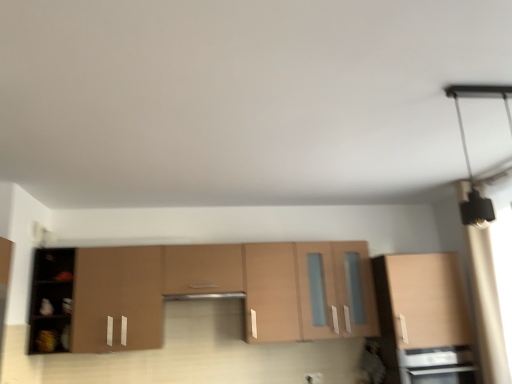
You are a GUI agent. You are given a task and a screenshot of the screen. Output one action in this format:
    pyautogui.click(x=<x>, y=<y>)
    Task: Click on the matte wood cabinet at right, the second cabinetry in the left-to-right sequence
    
    Given the screenshot: What is the action you would take?
    pos(423,319)

Describe the element at coordinates (437, 365) in the screenshot. I see `matte black oven at lower right` at that location.

This screenshot has height=384, width=512. What do you see at coordinates (203, 291) in the screenshot?
I see `matte brown cabinet at center, placed as the first cabinetry when sorted from left to right` at bounding box center [203, 291].

You are a GUI agent. You are given a task and a screenshot of the screen. Output one action in this format:
    pyautogui.click(x=<x>, y=<y>)
    Task: Click on the matte wood cabinet at right, the second cabinetry in the left-to-right sequence
    Image resolution: width=512 pixels, height=384 pixels.
    Given the screenshot: What is the action you would take?
    pyautogui.click(x=423, y=319)

Which object is thinner, matte black oven at lower right or satin silver exhaust hood at center?

satin silver exhaust hood at center is thinner.

Considering the relative positions of matte black oven at lower right and satin silver exhaust hood at center in the image provided, is matte black oven at lower right to the right of satin silver exhaust hood at center from the viewer's perspective?

Indeed, matte black oven at lower right is positioned on the right side of satin silver exhaust hood at center.

Does point (438, 380) lie behind point (242, 297)?

No.

Is the position of matte black oven at lower right more distant than that of satin silver exhaust hood at center?

No, it is not.

Is matte wood cabinet at right, acting as the 1th cabinetry starting from the right, bigger or smaller than satin silver exhaust hood at center?

In the image, matte wood cabinet at right, acting as the 1th cabinetry starting from the right, appears to be larger than satin silver exhaust hood at center.

Which object is positioned more to the left, matte wood cabinet at right, the second cabinetry in the left-to-right sequence, or satin silver exhaust hood at center?

From the viewer's perspective, satin silver exhaust hood at center appears more on the left side.

Is matte wood cabinet at right, the second cabinetry in the left-to-right sequence, aimed at satin silver exhaust hood at center?

No.

Locate an element on the screen. This screenshot has width=512, height=384. the 1st cabinetry in front of the satin silver exhaust hood at center is located at coordinates (423, 319).

Does satin silver exhaust hood at center contain black matte light fixture at upper right?

Definitely not — black matte light fixture at upper right is not inside satin silver exhaust hood at center.

Does point (240, 297) appear closer or farther from the camera than point (477, 192)?

Point (240, 297) is farther from the camera than point (477, 192).

Which is in front, satin silver exhaust hood at center or black matte light fixture at upper right?

black matte light fixture at upper right is more forward.

Who is bigger, satin silver exhaust hood at center or black matte light fixture at upper right?

With larger size is black matte light fixture at upper right.

Can you tell me how much matte black oven at lower right and matte brown cabinet at center, placed as the first cabinetry when sorted from left to right, differ in facing direction?

1.6e-05 degrees.

Is matte black oven at lower right not close to matte brown cabinet at center, placed as the first cabinetry when sorted from left to right?

They are positioned close to each other.

Is matte black oven at lower right wider or thinner than matte brown cabinet at center, which is the 2th cabinetry from right to left?

matte black oven at lower right is wider than matte brown cabinet at center, which is the 2th cabinetry from right to left.

Consider the image. Is black matte light fixture at upper right positioned before matte wood cabinet at right, acting as the 1th cabinetry starting from the right?

Yes, the depth of black matte light fixture at upper right is less than that of matte wood cabinet at right, acting as the 1th cabinetry starting from the right.

From a real-world perspective, is black matte light fixture at upper right located higher than matte wood cabinet at right, acting as the 1th cabinetry starting from the right?

Yes, from a real-world perspective, black matte light fixture at upper right is over matte wood cabinet at right, acting as the 1th cabinetry starting from the right

Considering the relative sizes of black matte light fixture at upper right and matte wood cabinet at right, acting as the 1th cabinetry starting from the right, in the image provided, is black matte light fixture at upper right taller than matte wood cabinet at right, acting as the 1th cabinetry starting from the right,?

Answer: No, black matte light fixture at upper right is not taller than matte wood cabinet at right, acting as the 1th cabinetry starting from the right.

Which is more to the left, black matte light fixture at upper right or matte wood cabinet at right, the second cabinetry in the left-to-right sequence?

From the viewer's perspective, black matte light fixture at upper right appears more on the left side.

At what (x,y) coordinates should I click in order to perform the action: click on light fixture above the matte brown cabinet at center, which is the 2th cabinetry from right to left (from a real-world perspective). Please return your answer as a coordinate pair (x, y). This screenshot has width=512, height=384. Looking at the image, I should click on (467, 151).

Is matte brown cabinet at center, placed as the first cabinetry when sorted from left to right, positioned beyond the bounds of black matte light fixture at upper right?

That's correct, matte brown cabinet at center, placed as the first cabinetry when sorted from left to right, is outside of black matte light fixture at upper right.

Does point (322, 293) lie in front of point (474, 219)?

No, (322, 293) is further to viewer.

Can you confirm if matte brown cabinet at center, placed as the first cabinetry when sorted from left to right, is positioned to the left of black matte light fixture at upper right?

Yes, matte brown cabinet at center, placed as the first cabinetry when sorted from left to right, is to the left of black matte light fixture at upper right.

Is satin silver exhaust hood at center at the left side of matte brown cabinet at center, placed as the first cabinetry when sorted from left to right?

Indeed, satin silver exhaust hood at center is positioned on the left side of matte brown cabinet at center, placed as the first cabinetry when sorted from left to right.

From a real-world perspective, which is physically below, satin silver exhaust hood at center or matte brown cabinet at center, placed as the first cabinetry when sorted from left to right?

satin silver exhaust hood at center.

Consider the image. Is satin silver exhaust hood at center wider or thinner than matte brown cabinet at center, which is the 2th cabinetry from right to left?

satin silver exhaust hood at center is wider than matte brown cabinet at center, which is the 2th cabinetry from right to left.

Where is `exhaust hood that appears behind the matte black oven at lower right`? The height and width of the screenshot is (384, 512). exhaust hood that appears behind the matte black oven at lower right is located at coordinates (204, 296).

Locate an element on the screen. This screenshot has height=384, width=512. exhaust hood above the matte wood cabinet at right, the second cabinetry in the left-to-right sequence (from the image's perspective) is located at coordinates (204, 296).

Looking at the image, which one is located further to satin silver exhaust hood at center, matte black oven at lower right or black matte light fixture at upper right?

black matte light fixture at upper right.

Based on their spatial positions, is matte brown cabinet at center, placed as the first cabinetry when sorted from left to right, or satin silver exhaust hood at center closer to matte black oven at lower right?

matte brown cabinet at center, placed as the first cabinetry when sorted from left to right.

From the image, which object appears to be nearer to matte brown cabinet at center, placed as the first cabinetry when sorted from left to right, matte wood cabinet at right, the second cabinetry in the left-to-right sequence, or matte black oven at lower right?

Based on the image, matte wood cabinet at right, the second cabinetry in the left-to-right sequence, appears to be nearer to matte brown cabinet at center, placed as the first cabinetry when sorted from left to right.

Based on their spatial positions, is matte brown cabinet at center, placed as the first cabinetry when sorted from left to right, or matte black oven at lower right further from satin silver exhaust hood at center?

Among the two, matte black oven at lower right is located further to satin silver exhaust hood at center.

Estimate the real-world distances between objects in this image. Which object is closer to satin silver exhaust hood at center, matte black oven at lower right or matte brown cabinet at center, which is the 2th cabinetry from right to left?

matte brown cabinet at center, which is the 2th cabinetry from right to left.

When comparing their distances from matte black oven at lower right, does black matte light fixture at upper right or matte wood cabinet at right, the second cabinetry in the left-to-right sequence, seem closer?

Based on the image, matte wood cabinet at right, the second cabinetry in the left-to-right sequence, appears to be nearer to matte black oven at lower right.

Estimate the real-world distances between objects in this image. Which object is further from black matte light fixture at upper right, matte black oven at lower right or matte wood cabinet at right, acting as the 1th cabinetry starting from the right?

The object further to black matte light fixture at upper right is matte black oven at lower right.

Looking at the image, which one is located further to satin silver exhaust hood at center, matte wood cabinet at right, the second cabinetry in the left-to-right sequence, or matte black oven at lower right?

matte black oven at lower right.

I want to click on light fixture between satin silver exhaust hood at center and matte wood cabinet at right, the second cabinetry in the left-to-right sequence, so click(467, 151).

Find the location of `cabinetry situated between matte brown cabinet at center, placed as the first cabinetry when sorted from left to right, and matte black oven at lower right from left to right`. cabinetry situated between matte brown cabinet at center, placed as the first cabinetry when sorted from left to right, and matte black oven at lower right from left to right is located at coordinates (423, 319).

Identify the location of light fixture between matte brown cabinet at center, which is the 2th cabinetry from right to left, and matte black oven at lower right. Image resolution: width=512 pixels, height=384 pixels. (467, 151).

You are a GUI agent. You are given a task and a screenshot of the screen. Output one action in this format:
    pyautogui.click(x=<x>, y=<y>)
    Task: Click on the light fixture between satin silver exhaust hood at center and matte black oven at lower right
    The image size is (512, 384).
    Given the screenshot: What is the action you would take?
    pyautogui.click(x=467, y=151)